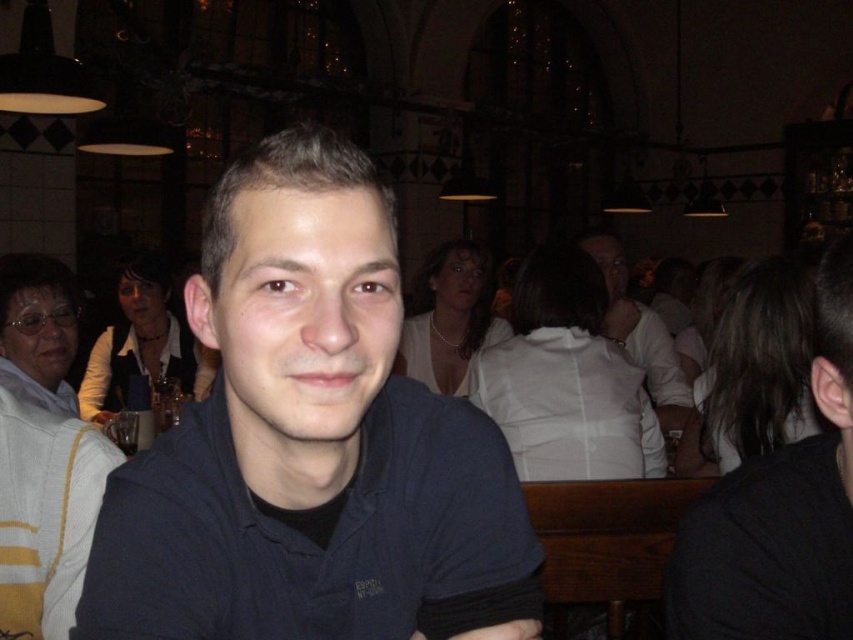
Question: Does dark blue shirt at center have a lesser width compared to white matte shirt at center?

Choices:
 (A) no
 (B) yes

Answer: (A)

Question: Among these objects, which one is farthest from the camera?

Choices:
 (A) dark blue shirt at center
 (B) white matte shirt at center

Answer: (B)

Question: Does dark blue shirt at center appear on the right side of white matte shirt at center?

Choices:
 (A) yes
 (B) no

Answer: (B)

Question: Among these objects, which one is farthest from the camera?

Choices:
 (A) white matte shirt at center
 (B) dark blue shirt at center

Answer: (A)

Question: Can you confirm if dark blue shirt at center is smaller than white matte shirt at center?

Choices:
 (A) yes
 (B) no

Answer: (A)